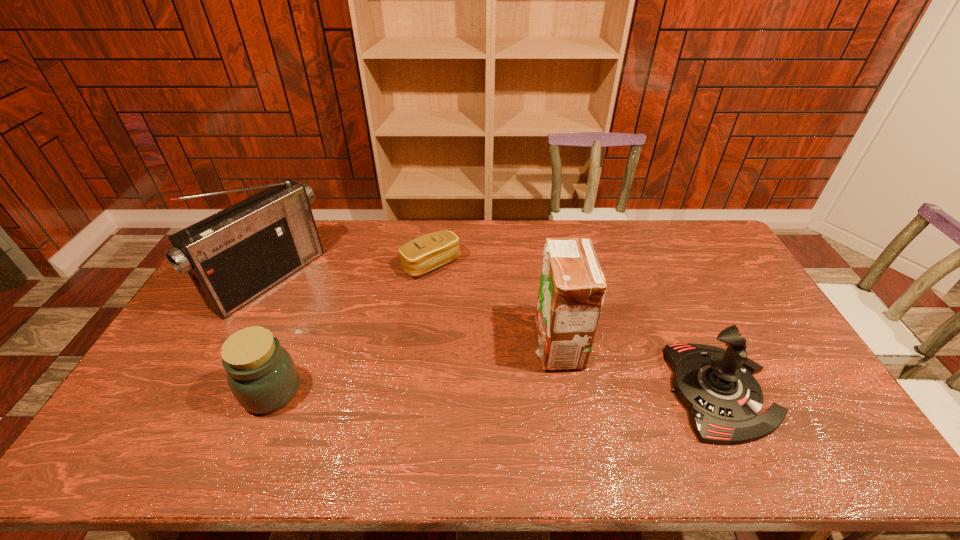
In the image, there is a desktop. At what (x,y) coordinates should I click in order to perform the action: click on blank space at the right edge. Please return your answer as a coordinate pair (x, y). This screenshot has height=540, width=960. Looking at the image, I should click on (716, 276).

This screenshot has height=540, width=960. Identify the location of free space between the third object from left to right and the jar. (351, 328).

You are a GUI agent. You are given a task and a screenshot of the screen. Output one action in this format:
    pyautogui.click(x=<x>, y=<y>)
    Task: Click on the vacant space that is in between the tallest object and the shortest object
    This screenshot has width=960, height=540.
    Given the screenshot: What is the action you would take?
    pyautogui.click(x=350, y=272)

Find the location of `free spot between the clutch bag and the second object from right to left`. free spot between the clutch bag and the second object from right to left is located at coordinates (494, 305).

Where is `free space between the rightmost object and the tallest object`? This screenshot has height=540, width=960. free space between the rightmost object and the tallest object is located at coordinates (495, 336).

Locate an element on the screen. This screenshot has width=960, height=540. vacant space that's between the radio receiver and the fourth object from left to right is located at coordinates (414, 313).

Locate an element on the screen. The width and height of the screenshot is (960, 540). object identified as the closest to the rightmost object is located at coordinates (572, 287).

Find the location of `the closest object to the second shortest object`. the closest object to the second shortest object is located at coordinates point(235,255).

What are the coordinates of `free point that satisfies the following two spatial constraints: 1. on the back side of the jar; 2. on the right side of the clutch bag` in the screenshot? It's located at (324, 265).

Where is `vacant region that satisfies the following two spatial constraints: 1. on the front side of the third tallest object; 2. on the handle side of the second shortest object`? This screenshot has width=960, height=540. vacant region that satisfies the following two spatial constraints: 1. on the front side of the third tallest object; 2. on the handle side of the second shortest object is located at coordinates (272, 392).